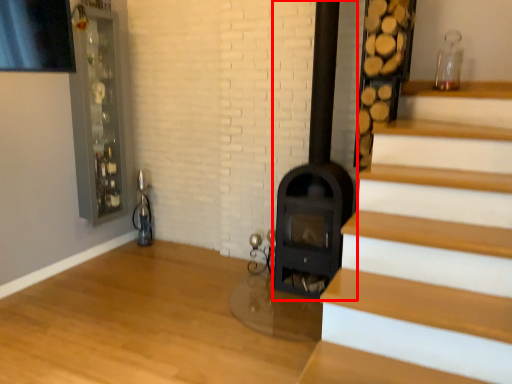
Question: From the image's perspective, what is the correct spatial positioning of fireplace (annotated by the red box) in reference to glass door?

Choices:
 (A) below
 (B) above

Answer: (A)